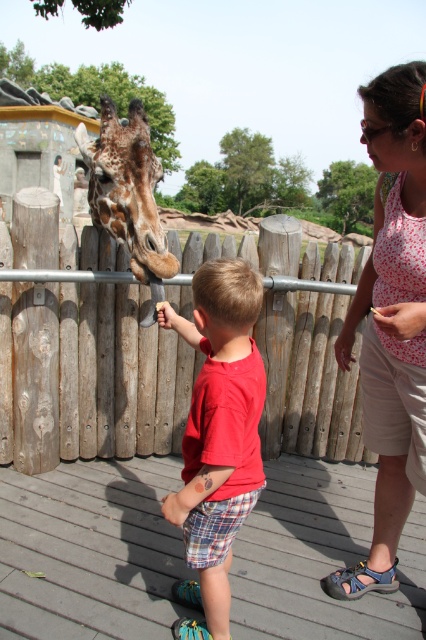
Between wooden fence at center and floral tank top at center, which one is positioned lower?

wooden fence at center is lower down.

Who is shorter, wooden fence at center or floral tank top at center?

Standing shorter between the two is wooden fence at center.

Who is more forward, (43,209) or (391,426)?

Point (391,426) is more forward.

The width and height of the screenshot is (426, 640). In order to click on wooden fence at center in this screenshot , I will do `click(80, 349)`.

Based on the photo, who is positioned more to the right, floral tank top at center or red cotton shirt at center?

floral tank top at center is more to the right.

Is floral tank top at center positioned in front of red cotton shirt at center?

That is False.

Where is `floral tank top at center`? The width and height of the screenshot is (426, 640). floral tank top at center is located at coordinates (391, 320).

Who is positioned more to the left, wooden fence at center or brown spotted fur at center?

brown spotted fur at center is more to the left.

In the scene shown: Does wooden fence at center have a smaller size compared to brown spotted fur at center?

Incorrect, wooden fence at center is not smaller in size than brown spotted fur at center.

Where is `wooden fence at center`? Image resolution: width=426 pixels, height=640 pixels. wooden fence at center is located at coordinates click(80, 349).

At what (x,y) coordinates should I click in order to perform the action: click on wooden fence at center. Please return your answer as a coordinate pair (x, y). The image size is (426, 640). Looking at the image, I should click on (80, 349).